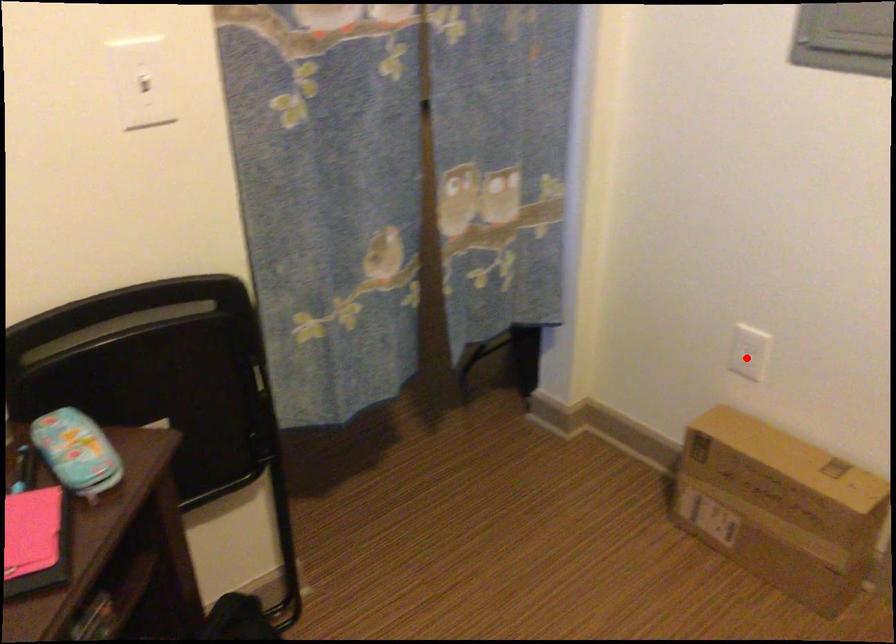
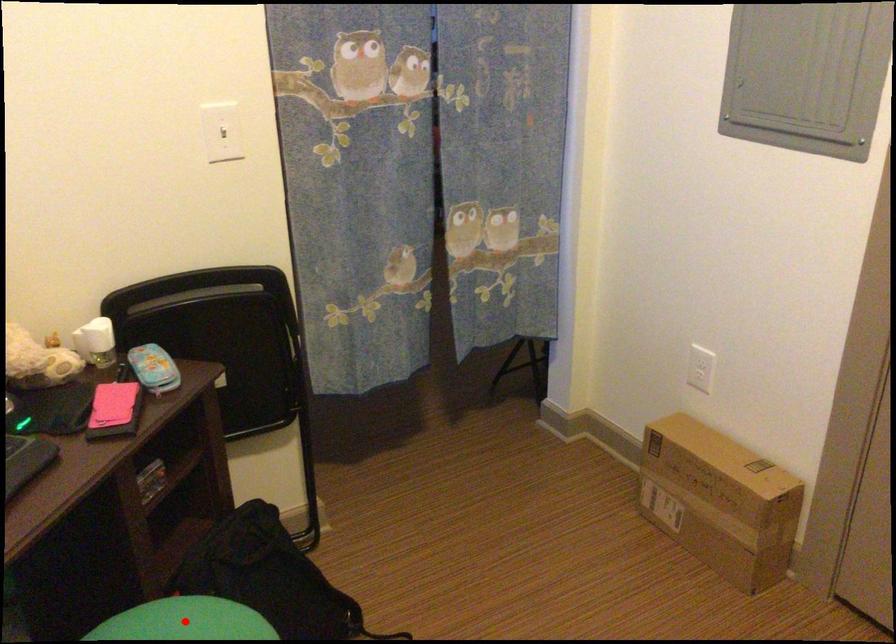
In the scene shown: I am providing you with two images of the same scene from different viewpoints. A red point is marked on the first image and another point is marked on the second image. Are the points marked in image1 and image2 representing the same 3D position?

No